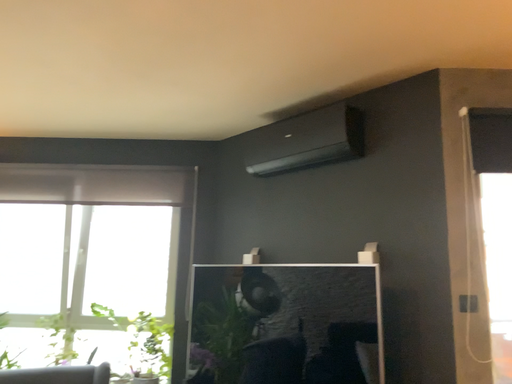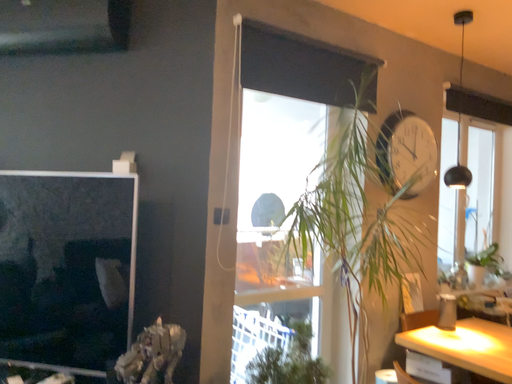
Question: How did the camera likely rotate when shooting the video?

Choices:
 (A) rotated right
 (B) rotated left

Answer: (A)